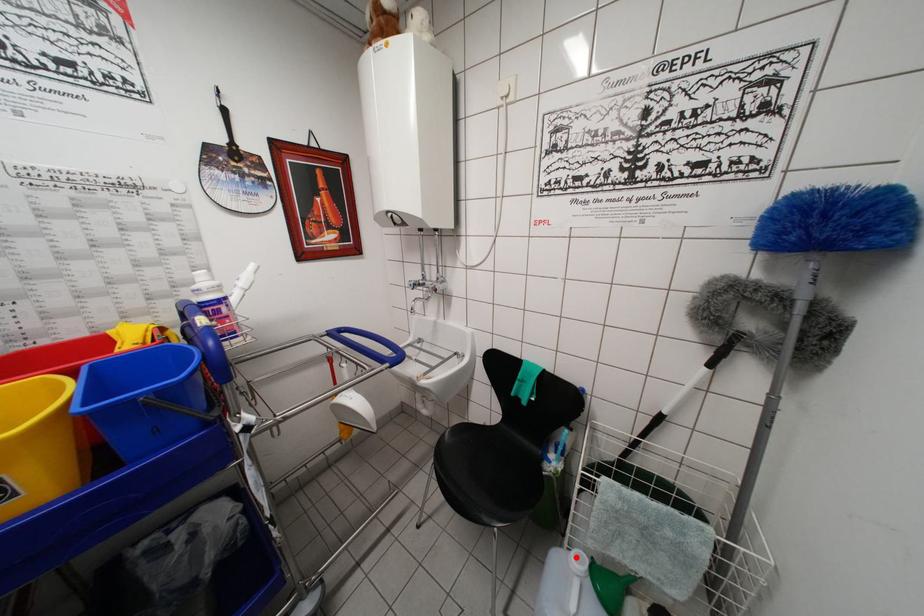
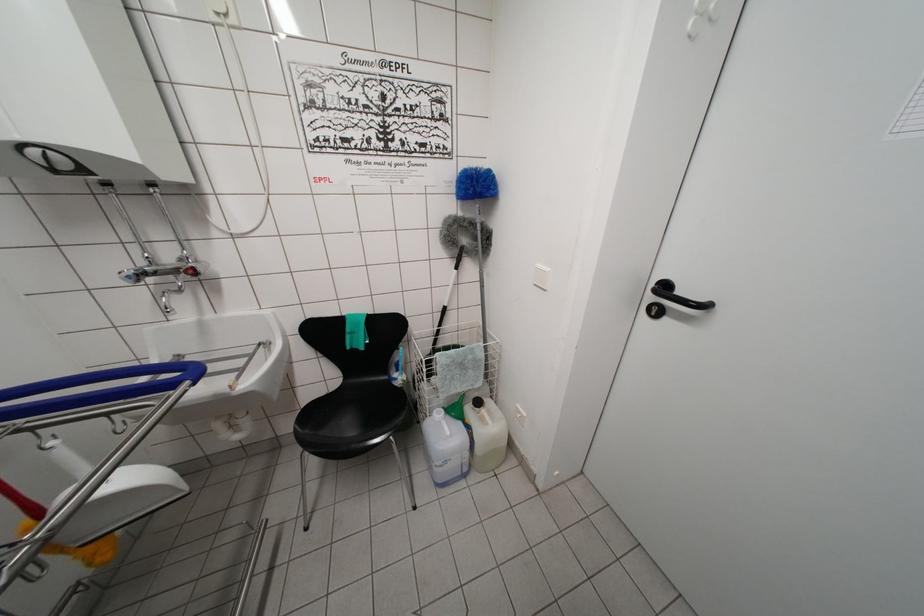
Question: I am providing you with two images of the same scene from different viewpoints. A red point is shown in image1. For the corresponding object point in image2, is it positioned nearer or farther from the camera?

Choices:
 (A) Nearer
 (B) Farther

Answer: (B)